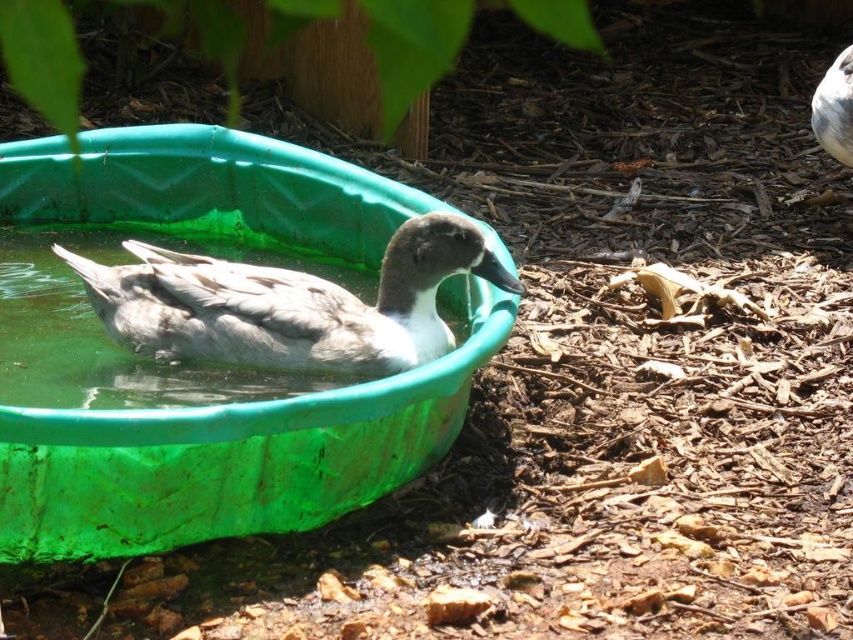
The height and width of the screenshot is (640, 853). What are the coordinates of `green plastic basin at center` in the screenshot? It's located at (230, 456).

Does green plastic basin at center have a greater width compared to gray matte duck at center?

Correct, the width of green plastic basin at center exceeds that of gray matte duck at center.

Image resolution: width=853 pixels, height=640 pixels. What do you see at coordinates (230, 456) in the screenshot? I see `green plastic basin at center` at bounding box center [230, 456].

Image resolution: width=853 pixels, height=640 pixels. Find the location of `green plastic basin at center`. green plastic basin at center is located at coordinates (230, 456).